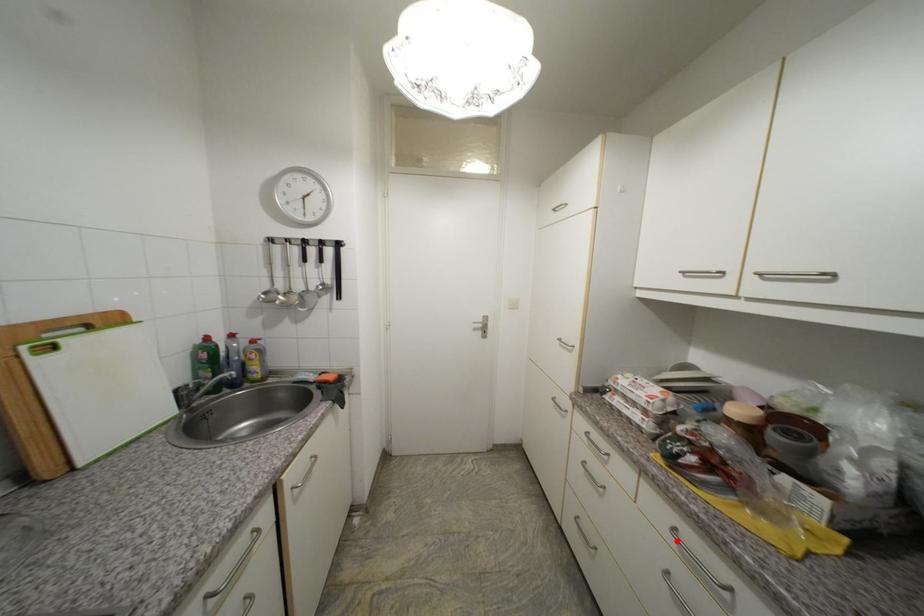
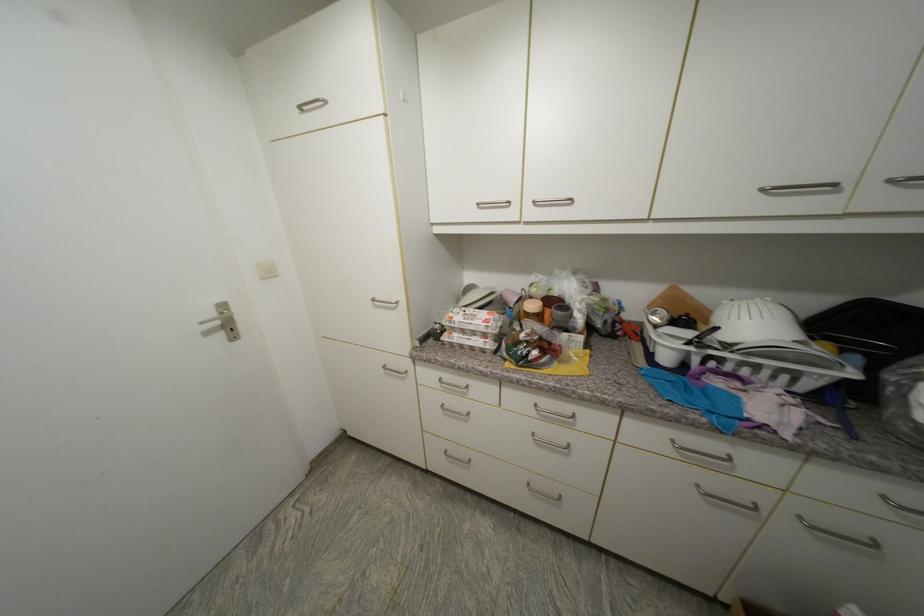
In the second image, find the point that corresponds to the highlighted location in the first image.

(539, 415)